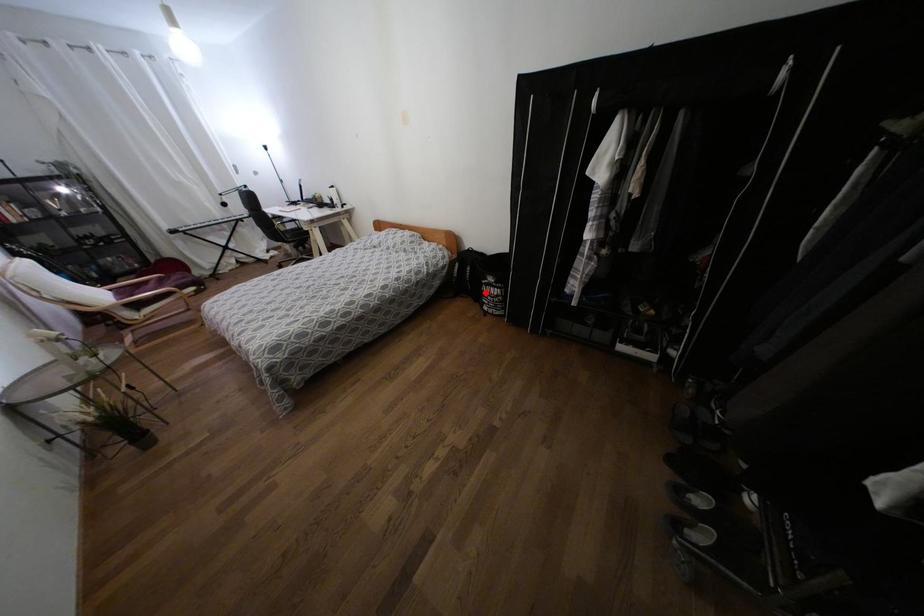
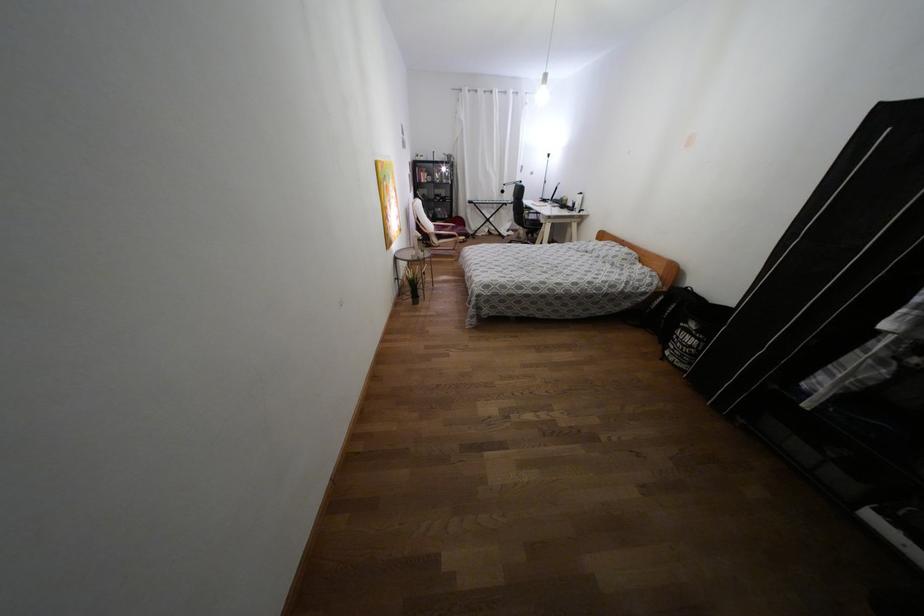
Question: I am providing you with two images of the same scene from different viewpoints. Given a red point in image1, look at the same physical point in image2. Is it:

Choices:
 (A) Closer to the viewpoint
 (B) Farther from the viewpoint

Answer: (A)